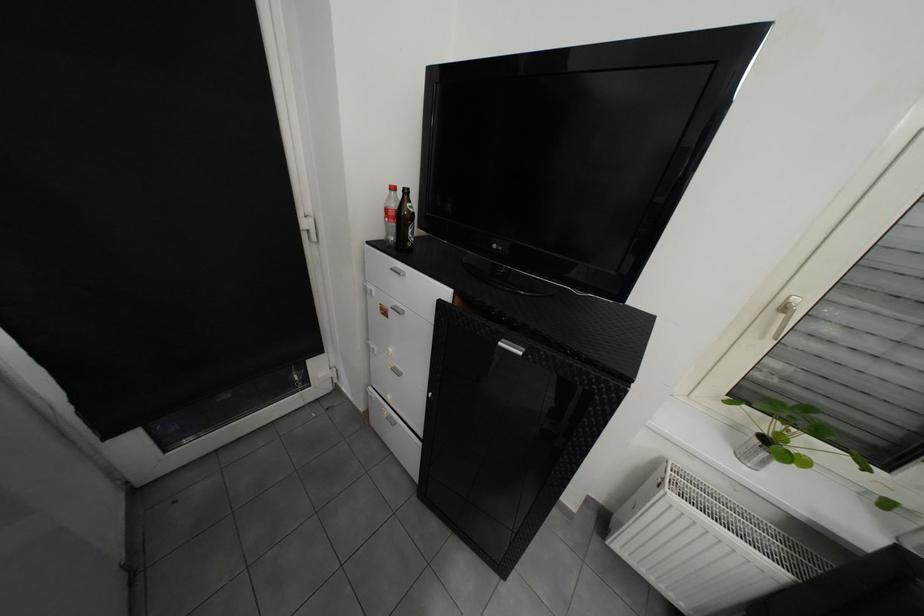
Where would you lift the plastic soda bottle? Please return your answer as a coordinate pair (x, y).

(390, 215)